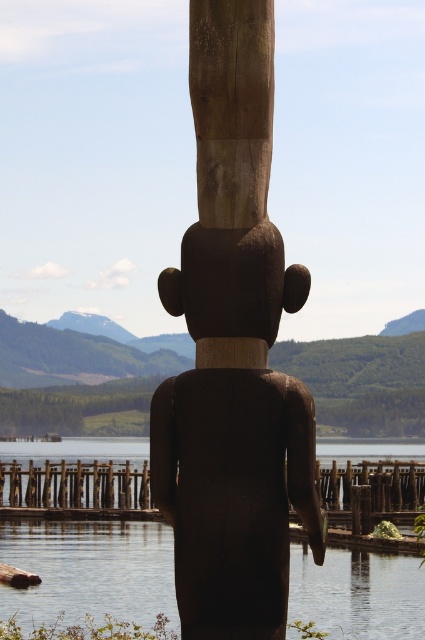
You are standing on the brown wooden dock at lower center and want to look towards the transparent water at center. In which direction should you turn your head?

You should turn your head to the right because the transparent water at center is to the right of the brown wooden dock at lower center.

You are standing in front of the wooden totem pole and want to take a photo. There are two points marked in the scene, point 1 at coordinates point (101, 536) and point 2 at coordinates point (59, 472). Which point will appear larger in your photo?

Point 1 at coordinates point (101, 536) will appear larger in the photo because it is closer to the camera than point 2 at coordinates point (59, 472).